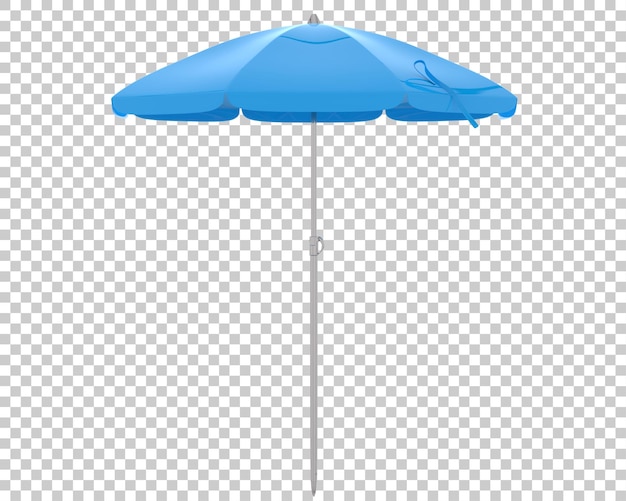
Locate an element on the screen. scalloped edging is located at coordinates (167, 109), (275, 106), (448, 104), (422, 120), (305, 118), (203, 119).